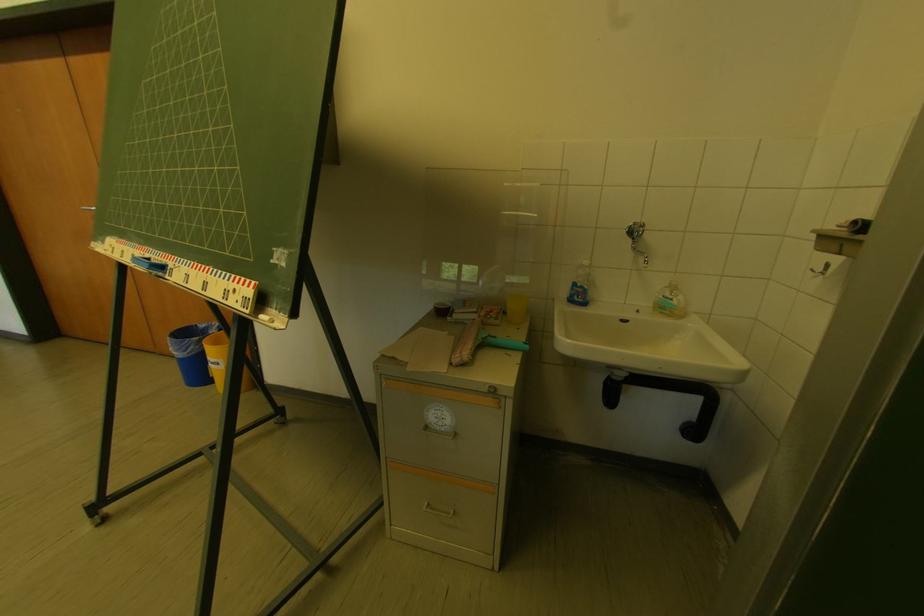
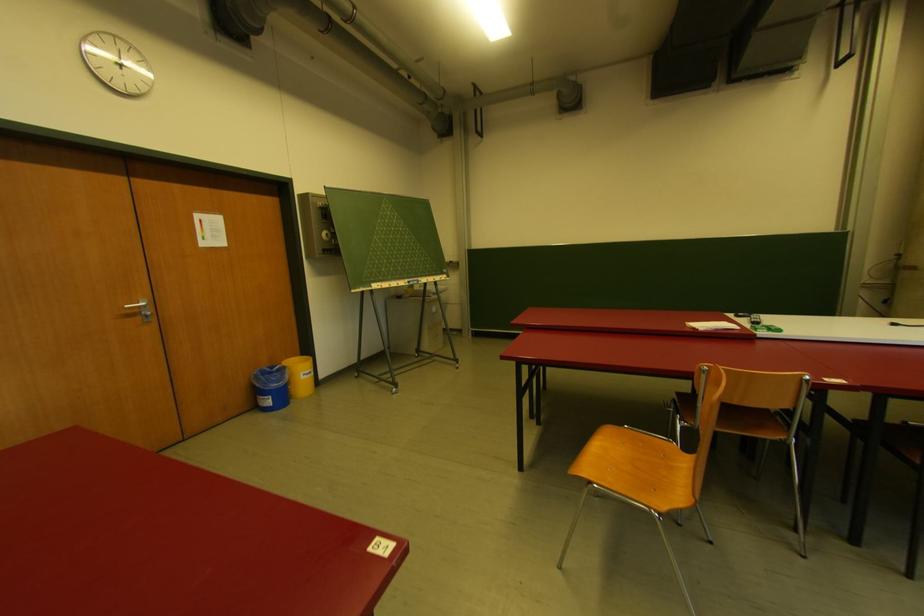
Where in the second image is the point corresponding to point 86,209 from the first image?

(128, 309)